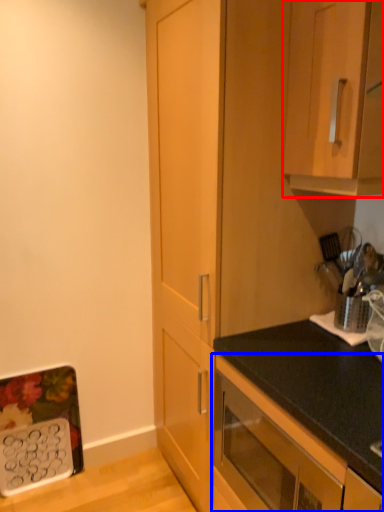
Question: Which object appears farthest to the camera in this image, cabinetry (highlighted by a red box) or cabinetry (highlighted by a blue box)?

Choices:
 (A) cabinetry
 (B) cabinetry

Answer: (A)